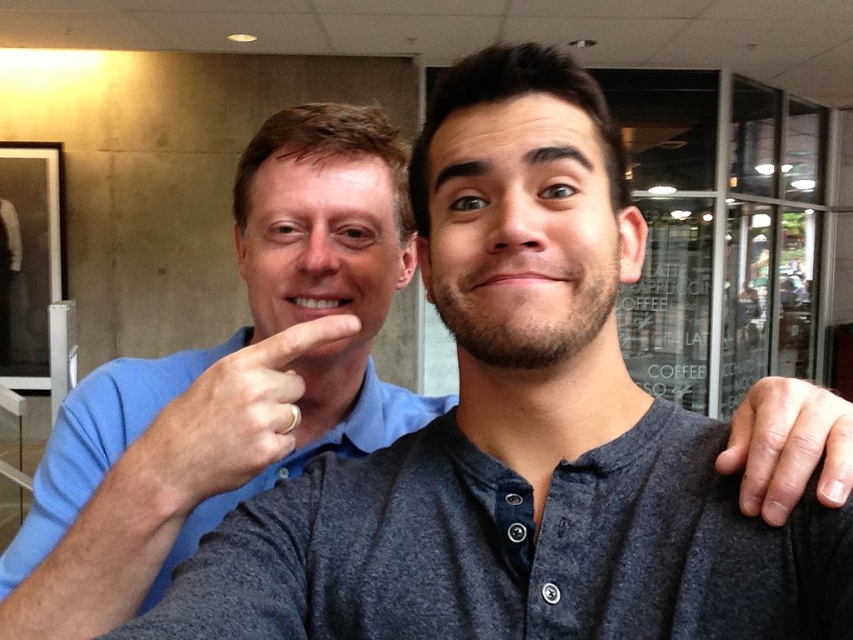
You are standing in a cafe and see a point marked at coordinates (97, 442). According to the scene, which object is this point located on?

The point at coordinates (97, 442) is located on the blue cotton shirt at center.

You are standing at the camera position and want to take a selfie with two friends. The point where you want to stand is at coordinate point (155, 477). If you need to move 20 inches forward to get a better shot, will you be able to reach that point without moving past it?

The distance between point (155, 477) and the camera is 21.11 inches. Moving forward 20 inches would bring you closer but not past the desired point, so yes, you can reach it without moving past.

You are a photographer setting up a shot of the two people in the image. You need to ensure that the blue cotton shirt at center and the gold metallic ring at center are both visible in the frame. Given their relative sizes, which object should you focus on to make sure both are in the frame?

The blue cotton shirt at center is taller than the gold metallic ring at center, so focusing on the blue cotton shirt at center will ensure both are visible since it is larger and can help frame the composition appropriately.